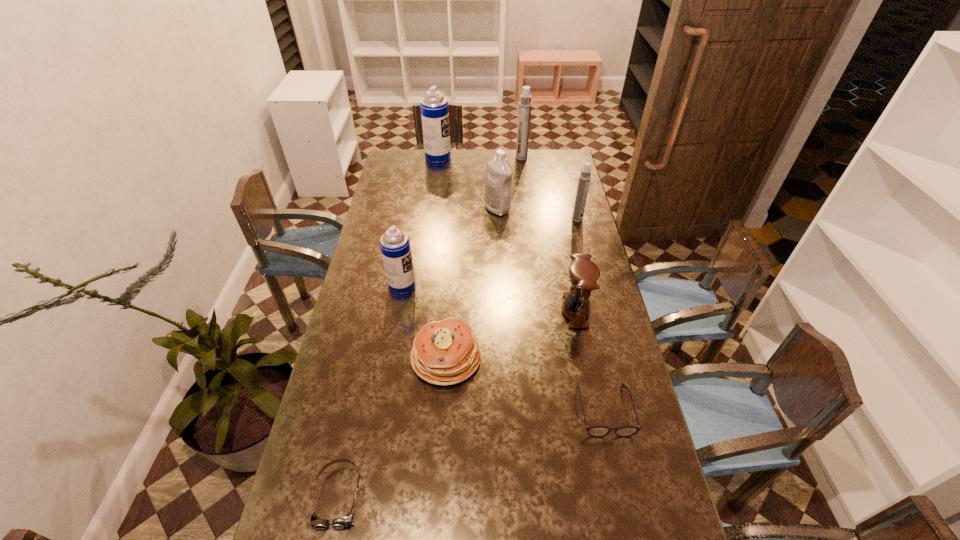
The image size is (960, 540). In order to click on brown hourglass in this screenshot , I will do `click(583, 274)`.

The image size is (960, 540). I want to click on pancake, so click(446, 352).

The width and height of the screenshot is (960, 540). In order to click on spectacles in this screenshot , I will do `click(595, 431)`.

Locate an element on the screen. the nearest object is located at coordinates (342, 522).

This screenshot has width=960, height=540. In order to click on brown goggles in this screenshot , I will do `click(342, 522)`.

You are a GUI agent. You are given a task and a screenshot of the screen. Output one action in this format:
    pyautogui.click(x=<x>, y=<y>)
    Task: Click on the free space located on the label side of the bigger blue aerosol can
    Image resolution: width=960 pixels, height=540 pixels.
    Given the screenshot: What is the action you would take?
    pyautogui.click(x=467, y=157)

Where is `blank space located on the front of the left white aerosol can`? blank space located on the front of the left white aerosol can is located at coordinates (526, 195).

Where is `vacant region located on the right of the white detergent`? The width and height of the screenshot is (960, 540). vacant region located on the right of the white detergent is located at coordinates (538, 208).

You are a GUI agent. You are given a task and a screenshot of the screen. Output one action in this format:
    pyautogui.click(x=<x>, y=<y>)
    Task: Click on the blank area located 0.220m on the label side of the nearest aerosol can
    
    Given the screenshot: What is the action you would take?
    pyautogui.click(x=475, y=285)

Image resolution: width=960 pixels, height=540 pixels. I want to click on vacant space situated 0.070m on the front of the smaller white aerosol can, so click(x=581, y=233).